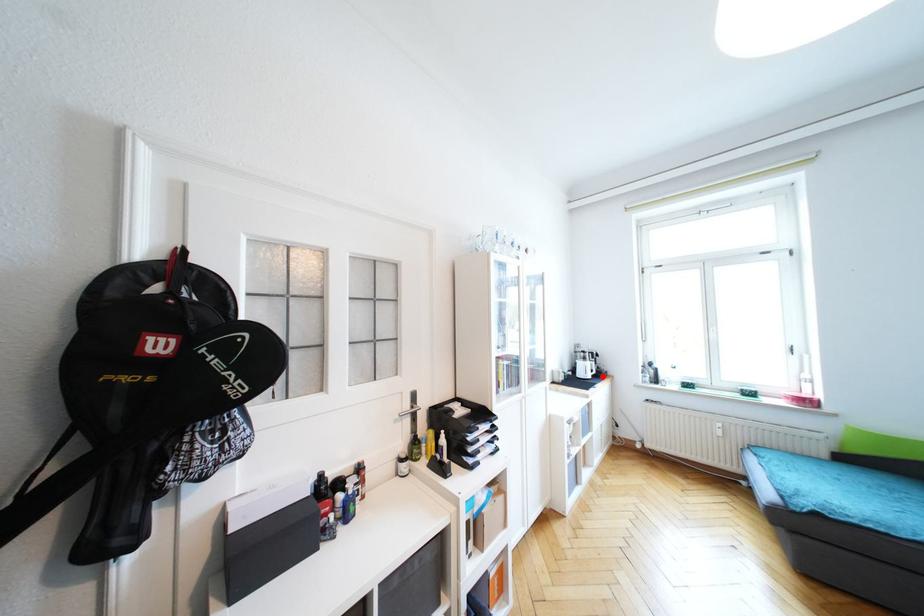
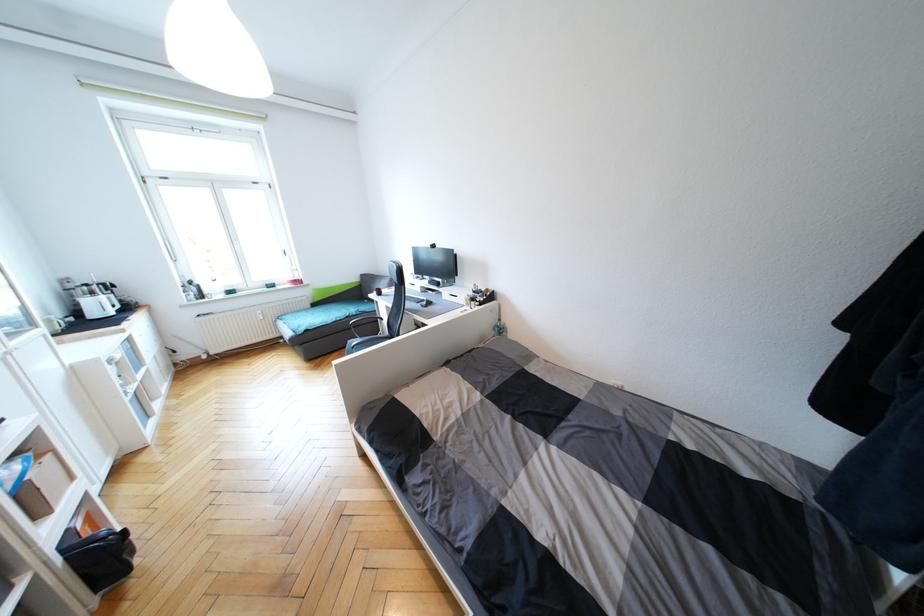
Where in the second image is the point corresponding to the highlighted location from the first image?

(130, 309)